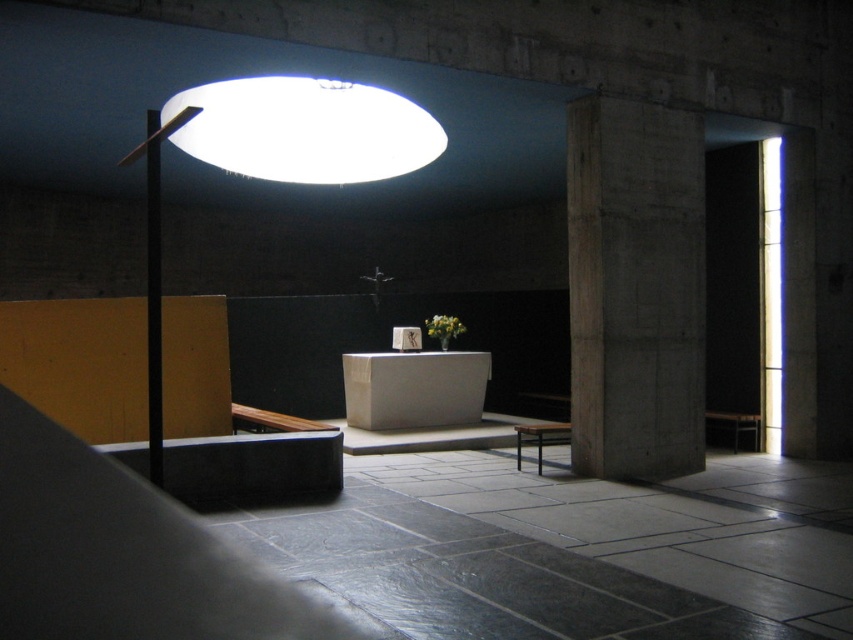
Question: Which of these objects is positioned farthest from the concrete pillar at center?

Choices:
 (A) wooden stool at center
 (B) white matte lampshade at upper center

Answer: (B)

Question: Which is nearer to the concrete pillar at center?

Choices:
 (A) white matte lampshade at upper center
 (B) wooden stool at center

Answer: (B)

Question: From the image, what is the correct spatial relationship of white matte lampshade at upper center in relation to wooden stool at center?

Choices:
 (A) above
 (B) below

Answer: (A)

Question: Is concrete pillar at center below white matte lampshade at upper center?

Choices:
 (A) no
 (B) yes

Answer: (B)

Question: Which point is closer to the camera?

Choices:
 (A) white matte lampshade at upper center
 (B) wooden stool at center
 (C) concrete pillar at center

Answer: (C)

Question: Does white matte lampshade at upper center appear on the right side of wooden stool at center?

Choices:
 (A) no
 (B) yes

Answer: (A)